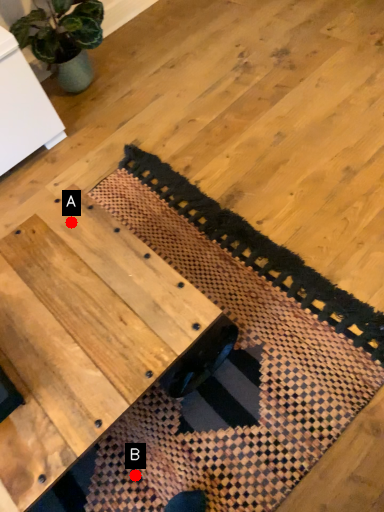
Question: Two points are circled on the image, labeled by A and B beside each circle. Which point appears closest to the camera in this image?

Choices:
 (A) A is closer
 (B) B is closer

Answer: (B)